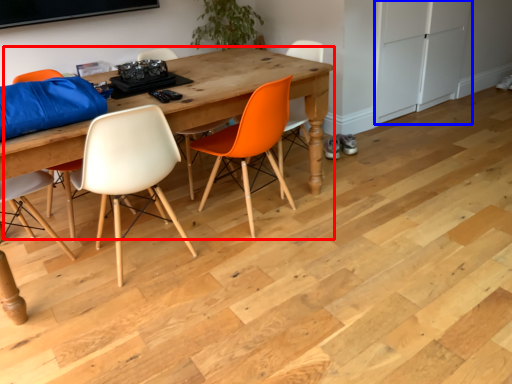
Question: Which object is further to the camera taking this photo, table (highlighted by a red box) or cabinetry (highlighted by a blue box)?

Choices:
 (A) table
 (B) cabinetry

Answer: (B)